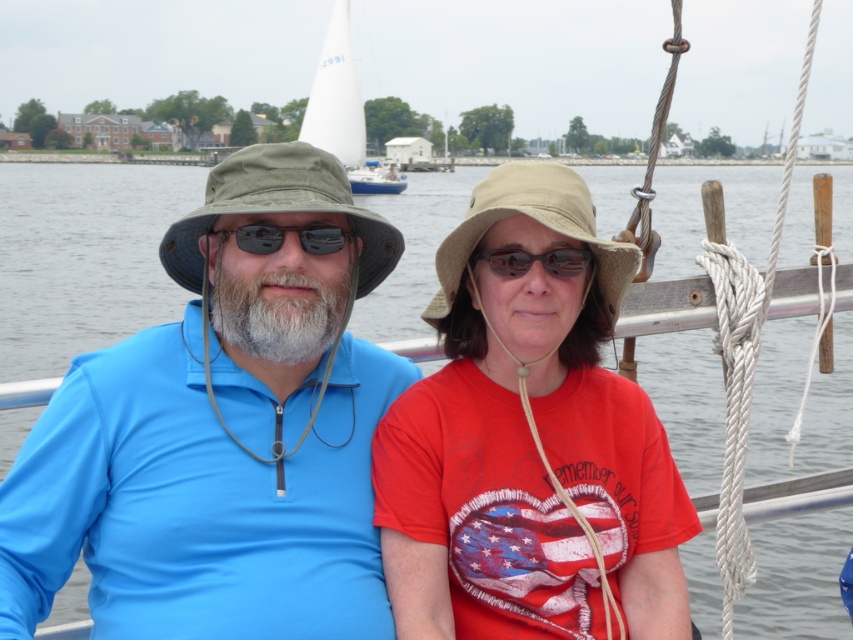
Does white sailboat at upper center appear over black plastic goggles at center?

Indeed, white sailboat at upper center is positioned over black plastic goggles at center.

Does point (392, 179) come behind point (526, 253)?

Yes, it is behind point (526, 253).

You are a GUI agent. You are given a task and a screenshot of the screen. Output one action in this format:
    pyautogui.click(x=<x>, y=<y>)
    Task: Click on the white sailboat at upper center
    This screenshot has height=640, width=853.
    Given the screenshot: What is the action you would take?
    pyautogui.click(x=343, y=113)

Is green camo hat at left bigger than black plastic goggles at center?

Indeed, green camo hat at left has a larger size compared to black plastic goggles at center.

Who is more distant from viewer, (x=318, y=189) or (x=483, y=250)?

The point (x=483, y=250) is behind.

Identify the location of green camo hat at left. Image resolution: width=853 pixels, height=640 pixels. (279, 208).

Does tan fabric hat at center have a lesser height compared to black plastic goggles at center?

No, tan fabric hat at center is not shorter than black plastic goggles at center.

Between point (635, 248) and point (511, 272), which one is positioned in front?

Point (635, 248) is in front.

The width and height of the screenshot is (853, 640). I want to click on tan fabric hat at center, so click(540, 224).